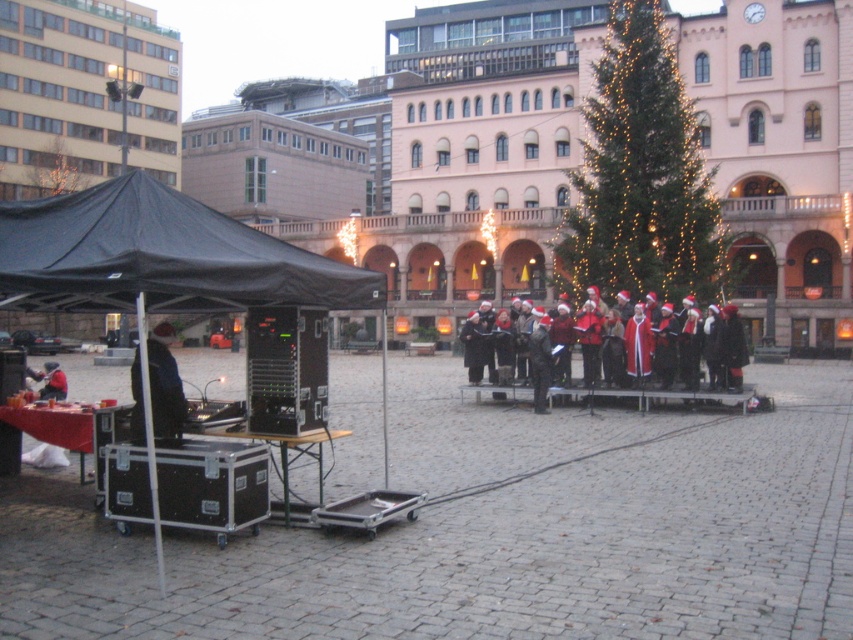
Question: Is black fabric canopy at left to the right of red velvet coat at center from the viewer's perspective?

Choices:
 (A) yes
 (B) no

Answer: (B)

Question: Which point is farther to the camera?

Choices:
 (A) red velvet coat at center
 (B) black fabric canopy at left
 (C) black fabric tent at left

Answer: (A)

Question: Which point appears farthest from the camera in this image?

Choices:
 (A) (125, 205)
 (B) (624, 394)

Answer: (B)

Question: Observing the image, what is the correct spatial positioning of black fabric tent at left in reference to black fabric canopy at left?

Choices:
 (A) left
 (B) right

Answer: (B)

Question: Does black fabric tent at left have a larger size compared to black fabric canopy at left?

Choices:
 (A) no
 (B) yes

Answer: (B)

Question: Among these objects, which one is farthest from the camera?

Choices:
 (A) red velvet coat at center
 (B) black fabric tent at left
 (C) black fabric canopy at left

Answer: (A)